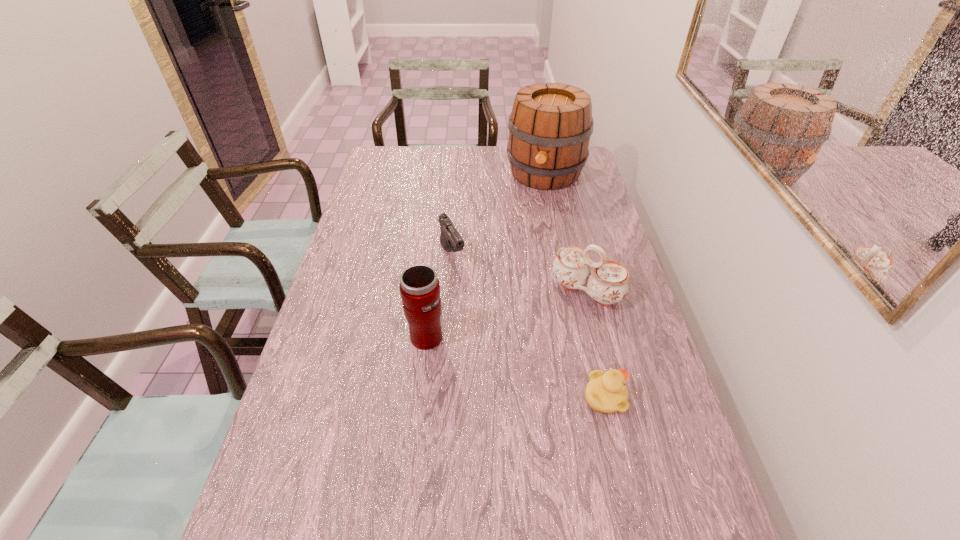
Where is `free space at the far left corner`? This screenshot has height=540, width=960. free space at the far left corner is located at coordinates (388, 147).

Locate an element on the screen. The image size is (960, 540). free point between the chinaware and the second tallest object is located at coordinates (505, 314).

This screenshot has width=960, height=540. I want to click on vacant region between the third tallest object and the farthest object, so 565,232.

This screenshot has height=540, width=960. In order to click on free space between the fourth farthest object and the farthest object in this screenshot , I will do click(x=485, y=255).

What are the coordinates of `free space between the nearest object and the second tallest object` in the screenshot? It's located at (515, 367).

You are a GUI agent. You are given a task and a screenshot of the screen. Output one action in this format:
    pyautogui.click(x=<x>, y=<y>)
    Task: Click on the empty location between the duckling and the third tallest object
    Image resolution: width=960 pixels, height=540 pixels.
    Given the screenshot: What is the action you would take?
    pyautogui.click(x=595, y=344)

This screenshot has width=960, height=540. Find the location of `blank region between the thermos bottle and the farthest object`. blank region between the thermos bottle and the farthest object is located at coordinates (485, 255).

What are the coordinates of `free spot between the chinaware and the second shortest object` in the screenshot? It's located at (519, 273).

Where is `free space between the nearest object and the chinaware`? The width and height of the screenshot is (960, 540). free space between the nearest object and the chinaware is located at coordinates (595, 344).

Identify the location of vacant space that's between the thermos bottle and the cider. Image resolution: width=960 pixels, height=540 pixels. (485, 255).